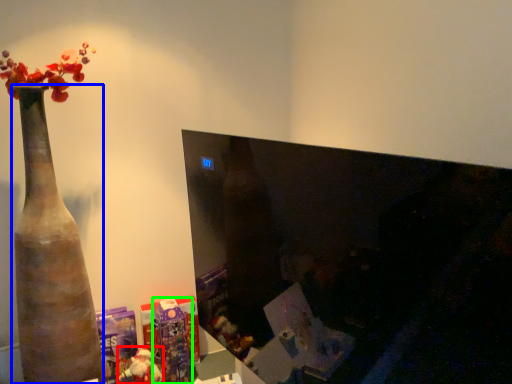
Question: Which is farther away from toy (highlighted by a red box)? vase (highlighted by a blue box) or toy (highlighted by a green box)?

Choices:
 (A) vase
 (B) toy

Answer: (A)